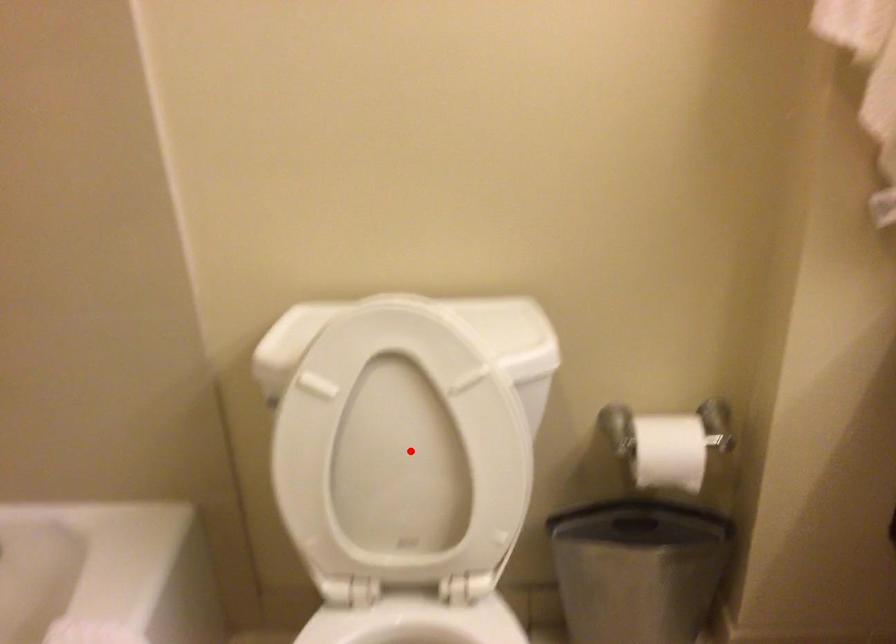
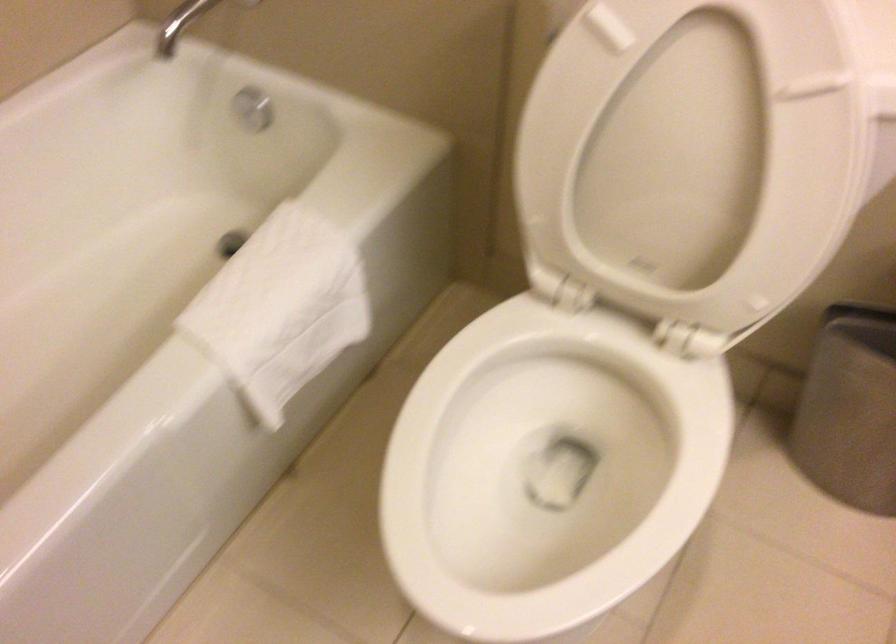
The point at the highlighted location is marked in the first image. Where is the corresponding point in the second image?

(691, 154)